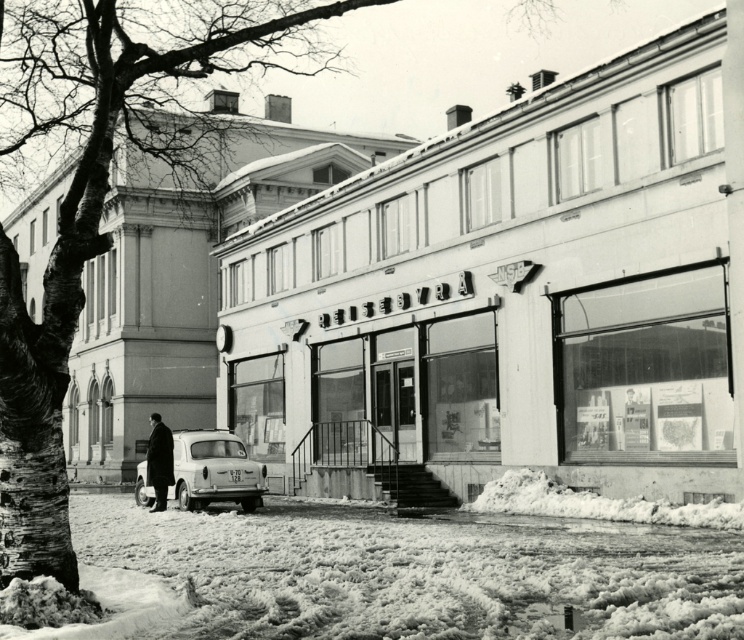
Who is positioned more to the right, white wood storefront at center or dark wool coat at center?

white wood storefront at center is more to the right.

Is point (525, 140) closer to viewer compared to point (170, 436)?

Yes, point (525, 140) is in front of point (170, 436).

Locate an element on the screen. white wood storefront at center is located at coordinates (516, 291).

Which is more to the left, white wood storefront at center or white matte car at lower center?

white matte car at lower center is more to the left.

Can you confirm if white wood storefront at center is taller than white matte car at lower center?

Correct, white wood storefront at center is much taller as white matte car at lower center.

Is point (420, 269) positioned after point (169, 492)?

Yes.

Where is `white wood storefront at center`? This screenshot has width=744, height=640. white wood storefront at center is located at coordinates (516, 291).

Looking at this image, is white matte car at lower center taller than dark wool coat at center?

In fact, white matte car at lower center may be shorter than dark wool coat at center.

Looking at this image, is white matte car at lower center to the left of dark wool coat at center from the viewer's perspective?

Indeed, white matte car at lower center is positioned on the left side of dark wool coat at center.

Where is `white matte car at lower center`? white matte car at lower center is located at coordinates (214, 470).